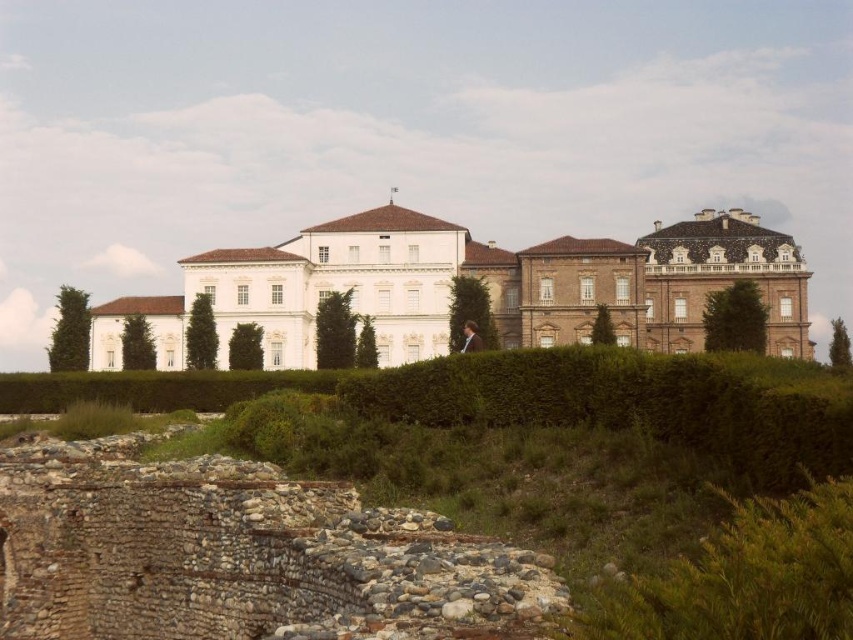
How far apart are white smooth mansion at center and brown fuzzy coat at center?

They are 87.53 feet apart.

Does white smooth mansion at center have a lesser height compared to brown fuzzy coat at center?

In fact, white smooth mansion at center may be taller than brown fuzzy coat at center.

The width and height of the screenshot is (853, 640). Identify the location of white smooth mansion at center. (479, 278).